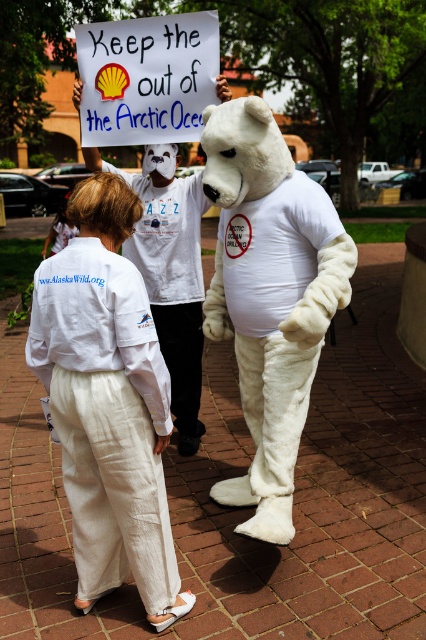
You are a photographer trying to capture a clear shot of the white paper sign at upper center and the white cotton pants at lower center. Given that your camera has a limited field of view, which object should you prioritize framing first to ensure it fits within the frame?

The white paper sign at upper center has a greater width than the white cotton pants at lower center, so you should prioritize framing the white paper sign at upper center first to ensure it fits within the camera frame.

You are a photographer trying to capture the protest scene. You notice the white linen pants at lower left and the white paper sign at upper center. Which object should you focus on if you want to highlight something smaller in the image?

The white linen pants at lower left should be focused on because it has a smaller size compared to the white paper sign at upper center.

You are a photographer trying to capture a photo of the protest scene. You notice two points in the image at coordinates point (115, 268) and point (176, 320). Which point is closer to your camera lens?

Point (115, 268) is closer to the viewer than point (176, 320), so the photographer should focus on that point first to ensure it is in sharp focus.